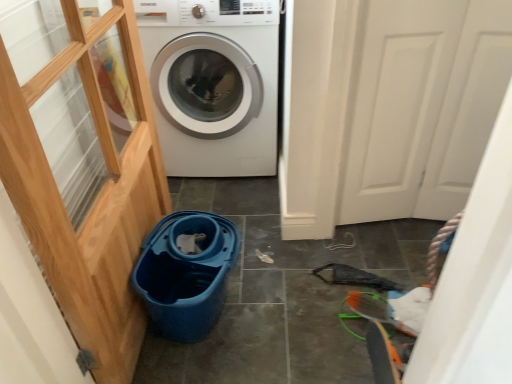
I want to click on blue plastic bucket at lower center, so click(x=186, y=274).

The height and width of the screenshot is (384, 512). Find the location of `blue plastic bucket at lower center`. blue plastic bucket at lower center is located at coordinates (186, 274).

Which object is wider, blue plastic bucket at lower center or white glossy washing machine at center?

With larger width is white glossy washing machine at center.

Locate an element on the screen. The image size is (512, 384). washing machine behind the blue plastic bucket at lower center is located at coordinates (213, 83).

Is point (155, 320) closer or farther from the camera than point (207, 102)?

Point (155, 320).

Could you tell me if blue plastic bucket at lower center is facing white glossy washing machine at center?

No, blue plastic bucket at lower center is not aimed at white glossy washing machine at center.

Is white glossy washing machine at center further to the viewer compared to white matte door at right?

That is True.

Based on the photo, is white glossy washing machine at center to the left or to the right of white matte door at right in the image?

In the image, white glossy washing machine at center appears on the left side of white matte door at right.

This screenshot has width=512, height=384. What are the coordinates of `screen door on the right of the white glossy washing machine at center` in the screenshot? It's located at (423, 105).

From the image's perspective, which is above, white glossy washing machine at center or white matte door at right?

white glossy washing machine at center.

Considering the positions of objects white glossy washing machine at center and blue plastic bucket at lower center in the image provided, who is more to the right, white glossy washing machine at center or blue plastic bucket at lower center?

From the viewer's perspective, blue plastic bucket at lower center appears more on the right side.

Is point (183, 14) more distant than point (224, 276)?

Yes, it is behind point (224, 276).

Based on the photo, in terms of width, does white glossy washing machine at center look wider or thinner when compared to blue plastic bucket at lower center?

Considering their sizes, white glossy washing machine at center looks broader than blue plastic bucket at lower center.

From the image's perspective, is white glossy washing machine at center located above or below blue plastic bucket at lower center?

From the image's perspective, white glossy washing machine at center appears above blue plastic bucket at lower center.

Locate an element on the screen. screen door on the right of blue plastic bucket at lower center is located at coordinates (423, 105).

Considering the positions of objects white matte door at right and blue plastic bucket at lower center in the image provided, who is more to the right, white matte door at right or blue plastic bucket at lower center?

white matte door at right is more to the right.

Which of these two, white matte door at right or blue plastic bucket at lower center, is thinner?

white matte door at right is thinner.

Does point (454, 187) lie behind point (202, 289)?

That is True.

Find the location of a particular element. The height and width of the screenshot is (384, 512). recycling bin in front of the white matte door at right is located at coordinates (186, 274).

Which of these two, blue plastic bucket at lower center or white matte door at right, stands shorter?

Standing shorter between the two is blue plastic bucket at lower center.

How different are the orientations of blue plastic bucket at lower center and white matte door at right in degrees?

They differ by 81.6 degrees in their facing directions.

From the image's perspective, is blue plastic bucket at lower center below white matte door at right?

Indeed, from the image's perspective, blue plastic bucket at lower center is shown beneath white matte door at right.

From the image's perspective, which is below, white matte door at right or white glossy washing machine at center?

white matte door at right is shown below in the image.

Which object is wider, white matte door at right or white glossy washing machine at center?

With larger width is white glossy washing machine at center.

Considering the sizes of white matte door at right and white glossy washing machine at center in the image, is white matte door at right bigger or smaller than white glossy washing machine at center?

Clearly, white matte door at right is smaller in size than white glossy washing machine at center.

From a real-world perspective, is white matte door at right above or below white glossy washing machine at center?

Clearly, from a real-world perspective, white matte door at right is above white glossy washing machine at center.

You are a GUI agent. You are given a task and a screenshot of the screen. Output one action in this format:
    pyautogui.click(x=<x>, y=<y>)
    Task: Click on the washing machine located above the blue plastic bucket at lower center (from the image's perspective)
    
    Given the screenshot: What is the action you would take?
    coord(213,83)

Identify the location of washing machine behind the white matte door at right. This screenshot has width=512, height=384. (213, 83).

Which object lies nearer to the anchor point white matte door at right, white glossy washing machine at center or blue plastic bucket at lower center?

white glossy washing machine at center is closer to white matte door at right.

When comparing their distances from white glossy washing machine at center, does white matte door at right or blue plastic bucket at lower center seem closer?

Based on the image, white matte door at right appears to be nearer to white glossy washing machine at center.

Estimate the real-world distances between objects in this image. Which object is closer to blue plastic bucket at lower center, white matte door at right or white glossy washing machine at center?

white glossy washing machine at center lies closer to blue plastic bucket at lower center than the other object.

Looking at the image, which one is located closer to blue plastic bucket at lower center, white glossy washing machine at center or white matte door at right?

The object closer to blue plastic bucket at lower center is white glossy washing machine at center.

From the image, which object appears to be nearer to white matte door at right, blue plastic bucket at lower center or white glossy washing machine at center?

white glossy washing machine at center lies closer to white matte door at right than the other object.

Based on their spatial positions, is blue plastic bucket at lower center or white matte door at right closer to white glossy washing machine at center?

Based on the image, white matte door at right appears to be nearer to white glossy washing machine at center.

Locate an element on the screen. recycling bin located between white glossy washing machine at center and white matte door at right in the left-right direction is located at coordinates (186, 274).